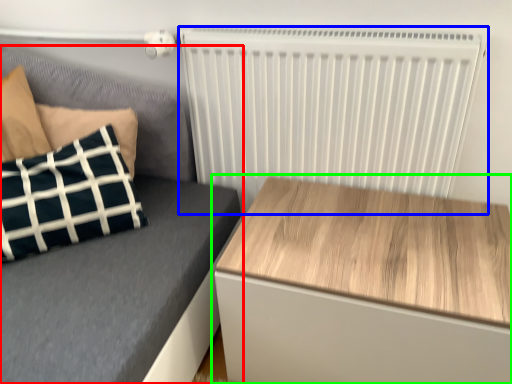
Question: Which object is positioned closest to furniture (highlighted by a red box)? Select from radiator (highlighted by a blue box) and table (highlighted by a green box).

Choices:
 (A) radiator
 (B) table

Answer: (A)